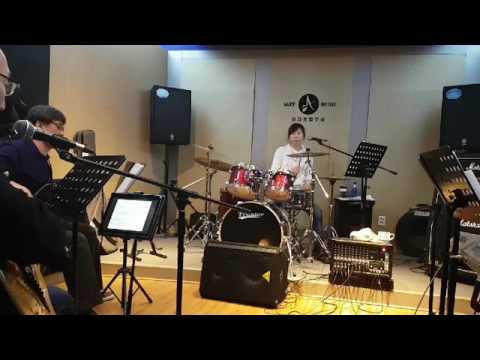
Image resolution: width=480 pixels, height=360 pixels. I want to click on music stand, so click(450, 183), click(358, 165), click(81, 183).